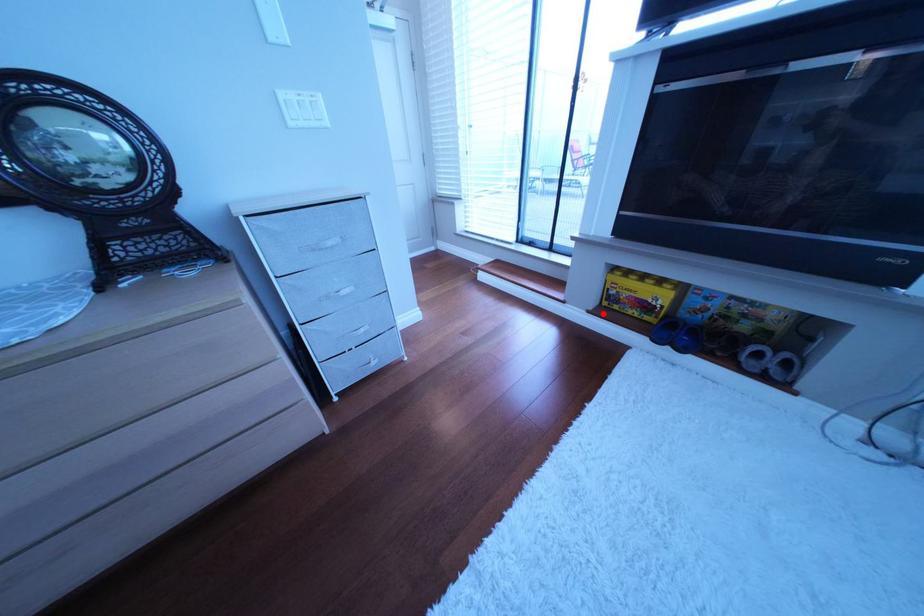
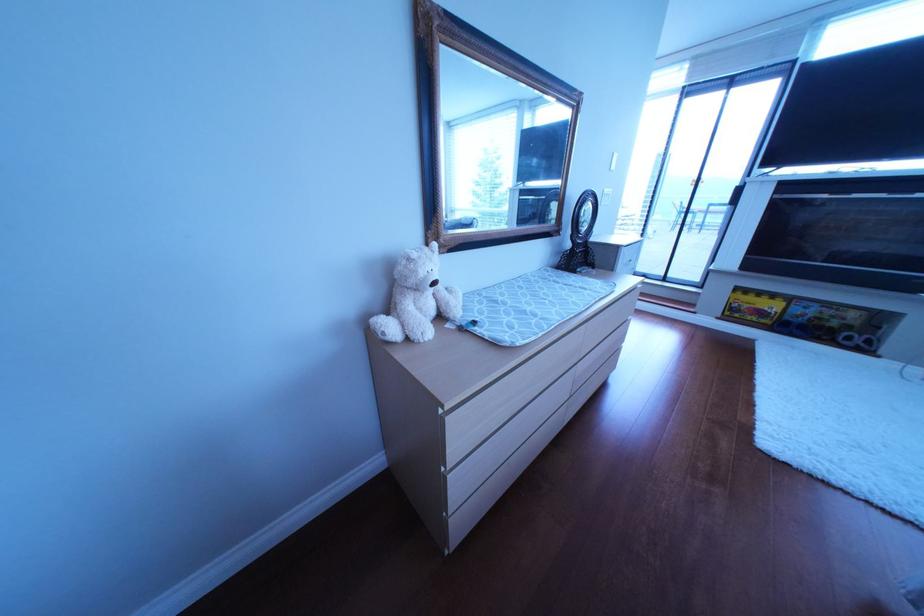
In the second image, find the point that corresponds to the highlighted location in the first image.

(733, 320)